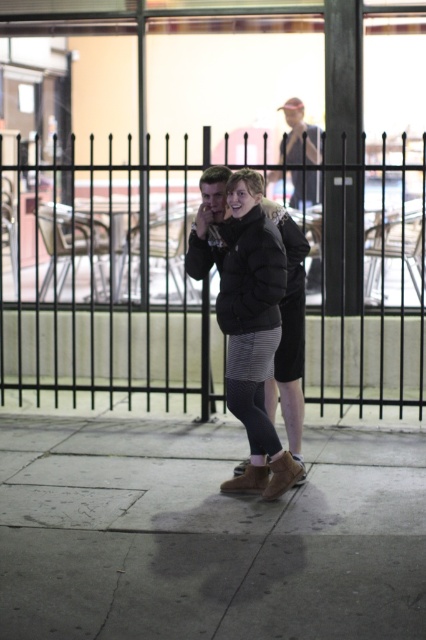
Question: Does black metal fence at center appear on the left side of light brown leather jacket at upper center?

Choices:
 (A) yes
 (B) no

Answer: (A)

Question: Which point is farther to the camera?

Choices:
 (A) (261, 237)
 (B) (58, 534)

Answer: (A)

Question: Can you confirm if brown leather boots at center is bigger than black metal fence at center?

Choices:
 (A) no
 (B) yes

Answer: (A)

Question: Which of the following is the farthest from the observer?

Choices:
 (A) (307, 131)
 (B) (376, 497)
 (C) (134, 216)

Answer: (C)

Question: Which point is closer to the camera?

Choices:
 (A) brown leather boots at center
 (B) black puffer jacket at center

Answer: (A)

Question: Is brown leather boots at center smaller than black puffer jacket at center?

Choices:
 (A) no
 (B) yes

Answer: (A)